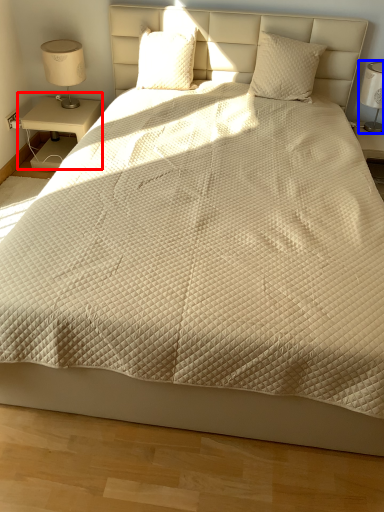
Question: Which object is closer to the camera taking this photo, nightstand (highlighted by a red box) or bedside lamp (highlighted by a blue box)?

Choices:
 (A) nightstand
 (B) bedside lamp

Answer: (B)